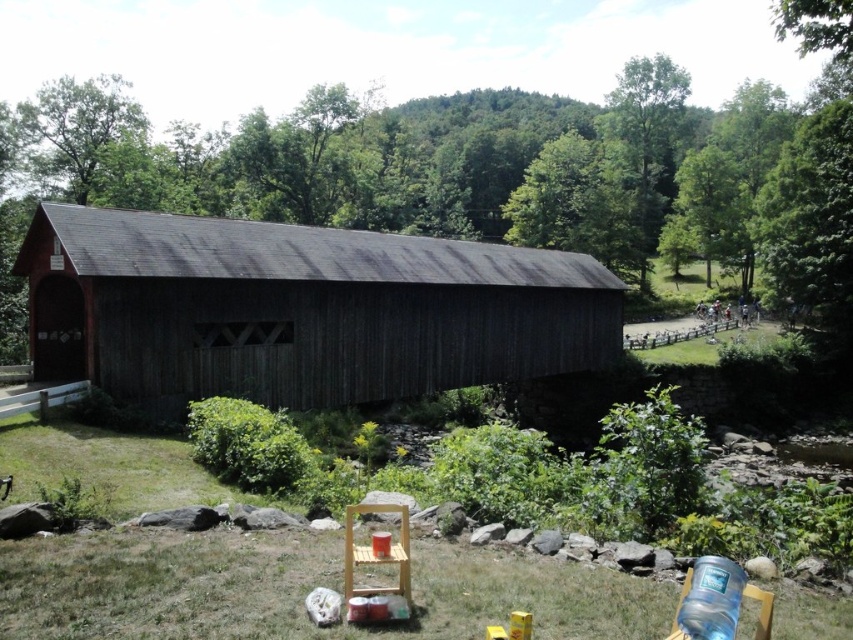
You are standing on the grassy area and want to cross the bridge to the other side. Which object, the dark brown wooden bridge at center or the green grass at lower center, is closer to you as you start your journey?

The green grass at lower center is closer to you since you are already standing on it, while the dark brown wooden bridge at center is in front of the grass and needs to be crossed.

You are planning to cross the dark brown wooden bridge at center while carrying a heavy backpack. Considering the width of the bridge and the green grass at lower center, which location would be safer for you to walk on?

The dark brown wooden bridge at center has a larger width than the green grass at lower center, so it would be safer to walk on the dark brown wooden bridge at center since it provides more space to maintain balance while carrying the heavy backpack.

You are a hiker who wants to cross the dark brown wooden bridge at center. However, you notice the green grass at lower center nearby. Which object is bigger in size?

The dark brown wooden bridge at center is larger in size than the green grass at lower center.